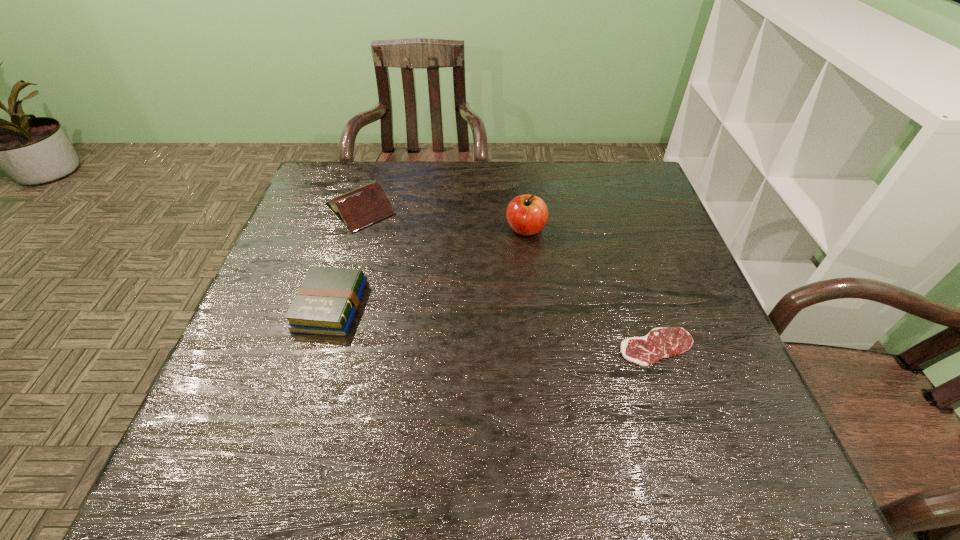
Image resolution: width=960 pixels, height=540 pixels. I want to click on the tallest object, so [x=527, y=215].

Locate an element on the screen. The image size is (960, 540). apple is located at coordinates (527, 215).

Locate an element on the screen. The width and height of the screenshot is (960, 540). the second tallest object is located at coordinates (361, 207).

This screenshot has height=540, width=960. What are the coordinates of `the farther book` in the screenshot? It's located at (361, 207).

Image resolution: width=960 pixels, height=540 pixels. Find the location of `the nearer book`. the nearer book is located at coordinates (325, 304).

Where is `the shorter book`? the shorter book is located at coordinates (325, 304).

The width and height of the screenshot is (960, 540). What are the coordinates of `the rightmost object` in the screenshot? It's located at (659, 343).

Identify the location of the shortest object. (659, 343).

At what (x,y) coordinates should I click in order to perform the action: click on free point located 0.210m on the right of the apple. Please return your answer as a coordinate pair (x, y). The image size is (960, 540). Looking at the image, I should click on (623, 229).

Where is `free region located on the front of the taller book`? The height and width of the screenshot is (540, 960). free region located on the front of the taller book is located at coordinates (344, 262).